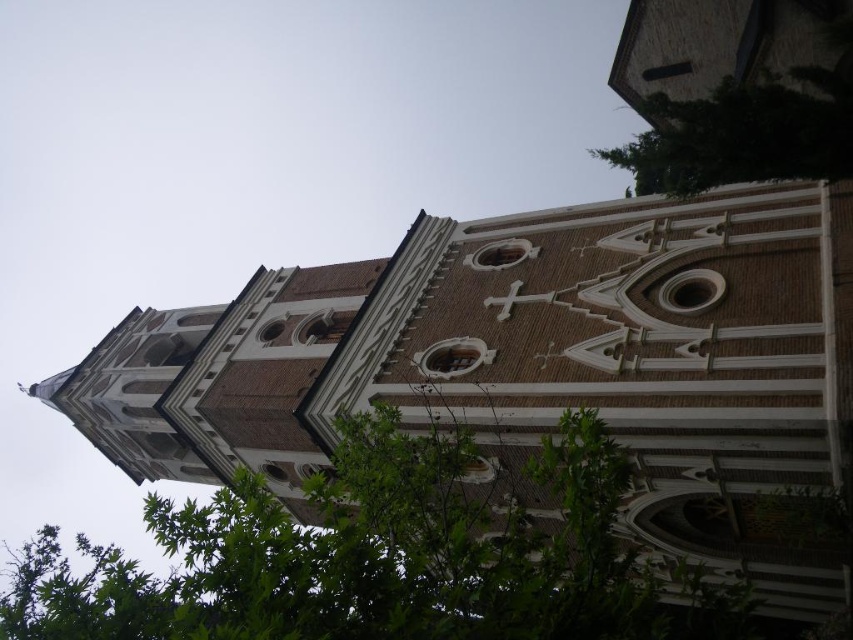
Question: Observing the image, what is the correct spatial positioning of green leafy tree at lower left in reference to green leafy tree at upper right?

Choices:
 (A) above
 (B) below

Answer: (B)

Question: Among these points, which one is nearest to the camera?

Choices:
 (A) (x=756, y=88)
 (B) (x=256, y=573)

Answer: (B)

Question: Is green leafy tree at lower left above green leafy tree at upper right?

Choices:
 (A) no
 (B) yes

Answer: (A)

Question: Does green leafy tree at lower left appear over green leafy tree at upper right?

Choices:
 (A) yes
 (B) no

Answer: (B)